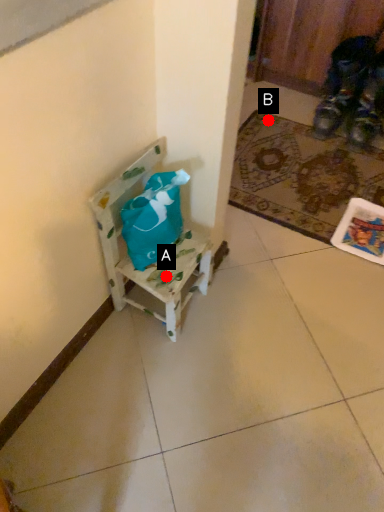
Question: Two points are circled on the image, labeled by A and B beside each circle. Which point is farther to the camera?

Choices:
 (A) A is further
 (B) B is further

Answer: (B)